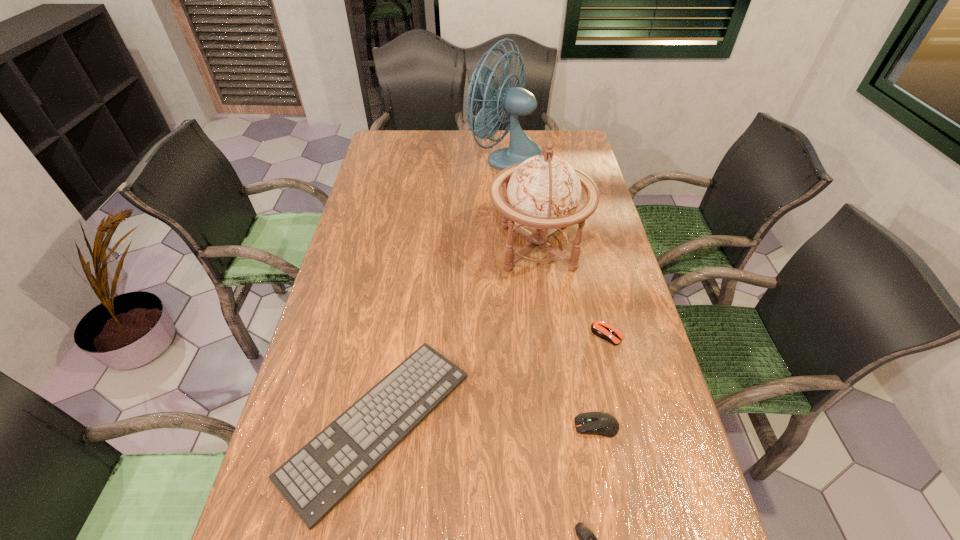
Image resolution: width=960 pixels, height=540 pixels. I want to click on vacant space that is in between the second tallest object and the third tallest object, so click(x=566, y=336).

Find the location of a particular element. This screenshot has height=540, width=960. free area in between the second tallest mouse and the tallest mouse is located at coordinates (602, 380).

Identify which object is the fourth nearest to the farthest object. Please provide its 2D coordinates. Your answer should be formatted as a tuple, i.e. [(x, y)], where the tuple contains the x and y coordinates of a point satisfying the conditions above.

[(604, 424)]

Find the location of `the fifth closest object to the fan`. the fifth closest object to the fan is located at coordinates (587, 539).

Identify the location of mouse that can be found as the second closest to the farthest mouse. The image size is (960, 540). (587, 539).

Select which mouse is the second closest to the farthest object. Please provide its 2D coordinates. Your answer should be formatted as a tuple, i.e. [(x, y)], where the tuple contains the x and y coordinates of a point satisfying the conditions above.

[(604, 424)]

Where is `blank area in the image that satisfies the following two spatial constraints: 1. at the front of the farthest mouse showing Africa; 2. on the left side of the globe`? Image resolution: width=960 pixels, height=540 pixels. blank area in the image that satisfies the following two spatial constraints: 1. at the front of the farthest mouse showing Africa; 2. on the left side of the globe is located at coordinates (549, 335).